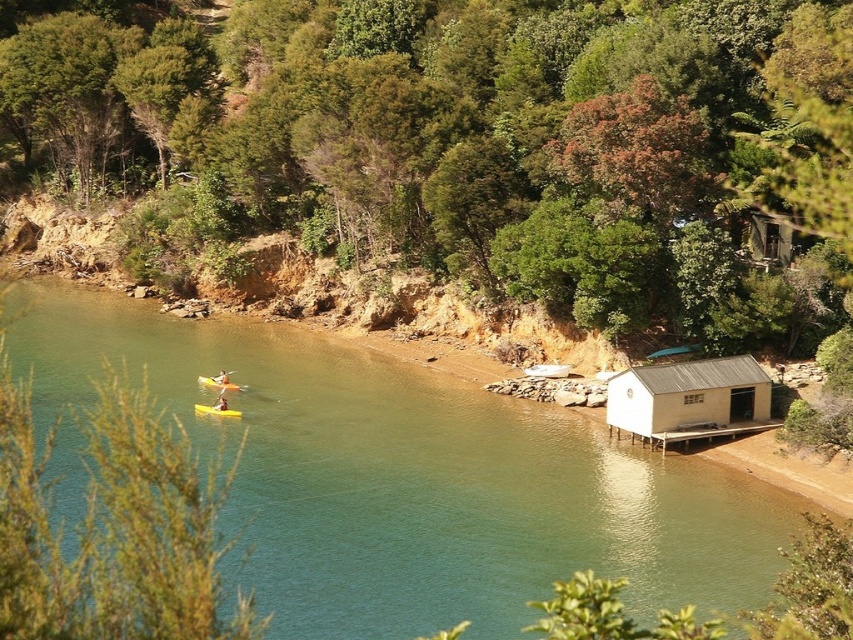
Which is above, green smooth water at center or yellow foam at center?

green smooth water at center is higher up.

Based on the photo, does green smooth water at center have a greater height compared to yellow foam at center?

Yes, green smooth water at center is taller than yellow foam at center.

What do you see at coordinates (405, 480) in the screenshot?
I see `green smooth water at center` at bounding box center [405, 480].

The width and height of the screenshot is (853, 640). I want to click on green smooth water at center, so click(x=405, y=480).

Who is shorter, yellow matte canoe at center or yellow foam at center?

With less height is yellow foam at center.

Between yellow matte canoe at center and yellow foam at center, which one is positioned lower?

yellow matte canoe at center

Looking at this image, who is more distant from viewer, (221, 416) or (219, 408)?

Point (219, 408)

Image resolution: width=853 pixels, height=640 pixels. What are the coordinates of `yellow matte canoe at center` in the screenshot? It's located at (216, 412).

Is green smooth water at center further to the viewer compared to white matte hut at lower right?

That is False.

Is point (608, 493) closer to camera compared to point (717, 360)?

Yes, it is in front of point (717, 360).

The width and height of the screenshot is (853, 640). I want to click on green smooth water at center, so click(x=405, y=480).